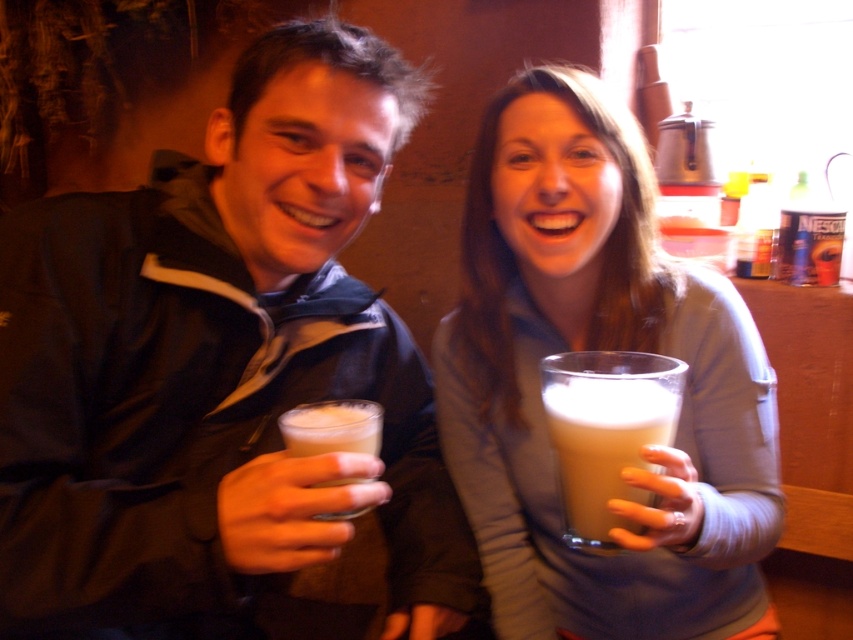
You are a barista who needs to place two cups on a shelf that can only hold items spaced exactly 7 inches apart. The shelf has a marker indicating where each cup should be placed. Can you position the foamy white liquid at center and the white frothy foam at left exactly on the shelf markers?

The distance between the foamy white liquid at center and white frothy foam at left is 7.07 inches, which is slightly more than 7 inches. Therefore, you cannot position them exactly on the shelf markers that require an exact 7 inches spacing.

You are a photographer trying to capture a closeup of the white frothy foam at left without including the matte black jacket at center in the frame. Is this possible given their positions?

The matte black jacket at center is to the left of the white frothy foam at left, so the jacket is positioned between the camera and the foam. This means the foam is further to the right relative to the jacket. To avoid including the jacket, you would need to adjust your angle or move closer to the foam to frame it without the jacket obstructing the shot.

You are a barista trying to determine which cup has more liquid based on their foam. The foamy white liquid at center is in a small glass cup, and the white frothy foam at left is in a larger glass cup. Which cup has a wider foam?

The foamy white liquid at center has a wider foam than the white frothy foam at left because its width surpasses the other.